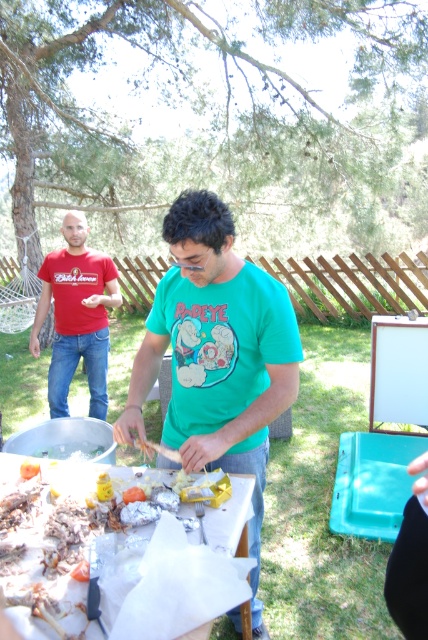
You are standing at the picnic table and want to reach both the point at (79, 230) and the point at (244, 604). Which point is closer to you?

The point at (244, 604) is closer to you because it is in front of the point at (79, 230).

You are a photographer trying to capture a closeup of the green matte shirt at center and the white paper at center. Since you want to focus on both items equally, which one should you adjust your camera angle to look up at?

You should adjust your camera angle to look up at the green matte shirt at center because it has a greater height compared to the white paper at center, ensuring both are in focus when capturing them equally.